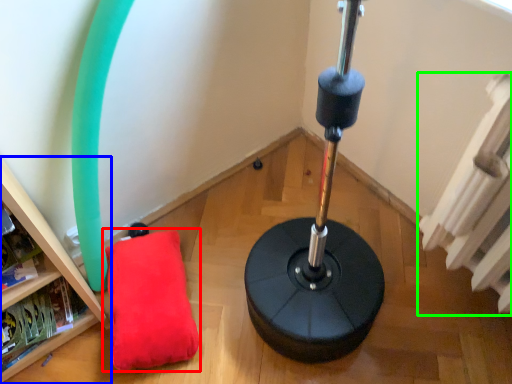
Question: Based on their relative distances, which object is nearer to pillow (highlighted by a red box)? Choose from furniture (highlighted by a blue box) and radiator (highlighted by a green box).

Choices:
 (A) furniture
 (B) radiator

Answer: (A)